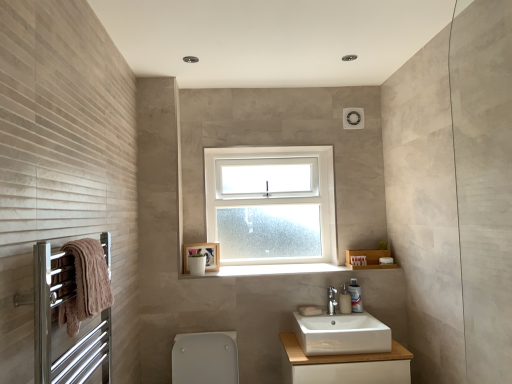
Identify the location of free space above white glossy cabinet at lower center (from a real-world perspective). (333, 348).